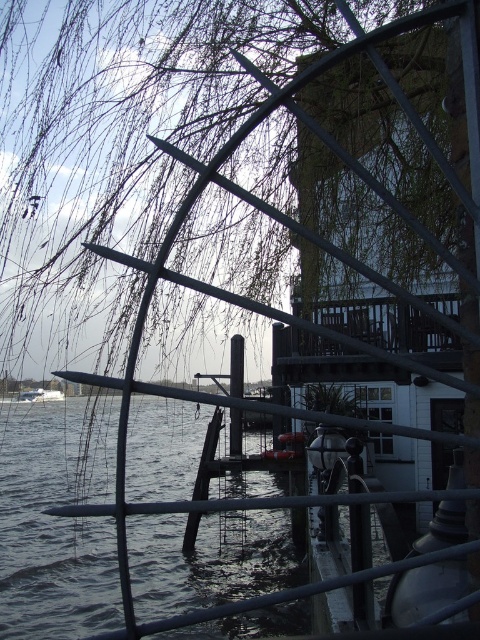
Can you confirm if green leafy tree at upper left is positioned below white glossy boat at lower left?

Actually, green leafy tree at upper left is above white glossy boat at lower left.

What do you see at coordinates (117, 138) in the screenshot?
I see `green leafy tree at upper left` at bounding box center [117, 138].

This screenshot has height=640, width=480. What are the coordinates of `green leafy tree at upper left` in the screenshot? It's located at pyautogui.click(x=117, y=138).